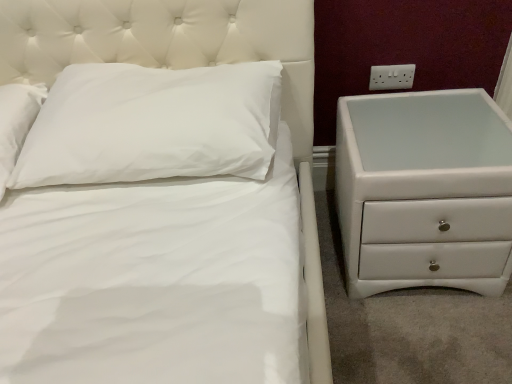
What do you see at coordinates (152, 124) in the screenshot?
I see `white soft pillow at upper left` at bounding box center [152, 124].

In order to face white glossy chest of drawers at right, should I rotate leftwards or rightwards?

To align with it, rotate right about 20.757°.

Locate an element on the screen. The image size is (512, 384). white glossy chest of drawers at right is located at coordinates (424, 191).

This screenshot has height=384, width=512. I want to click on white plastic electrical outlet at upper right, so [392, 77].

Describe the element at coordinates (392, 77) in the screenshot. I see `white plastic electrical outlet at upper right` at that location.

Locate an element on the screen. white soft pillow at upper left is located at coordinates (152, 124).

From the image's perspective, between white soft pillow at upper left and white glossy chest of drawers at right, who is located below?

white glossy chest of drawers at right appears lower in the image.

Does point (120, 73) appear closer or farther from the camera than point (382, 185)?

Point (120, 73).

Is white soft pillow at upper left positioned far away from white glossy chest of drawers at right?

That's not correct — white soft pillow at upper left is a little close to white glossy chest of drawers at right.

Is white plastic electrical outlet at upper right facing towards white soft pillow at upper left?

No, white plastic electrical outlet at upper right is not aimed at white soft pillow at upper left.

Considering the sizes of objects white plastic electrical outlet at upper right and white soft pillow at upper left in the image provided, who is wider, white plastic electrical outlet at upper right or white soft pillow at upper left?

white soft pillow at upper left is wider.

Do you think white plastic electrical outlet at upper right is within white soft pillow at upper left, or outside of it?

white plastic electrical outlet at upper right is not inside white soft pillow at upper left, it's outside.

The height and width of the screenshot is (384, 512). I want to click on electric outlet lying on the right of white soft pillow at upper left, so click(x=392, y=77).

Is white glossy chest of drawers at right at the right side of white soft pillow at upper left?

Indeed, white glossy chest of drawers at right is positioned on the right side of white soft pillow at upper left.

Can you confirm if white glossy chest of drawers at right is thinner than white soft pillow at upper left?

No, white glossy chest of drawers at right is not thinner than white soft pillow at upper left.

From the image's perspective, does white glossy chest of drawers at right appear higher than white soft pillow at upper left?

No.

From a real-world perspective, is white plastic electrical outlet at upper right over white glossy chest of drawers at right?

Correct, in the physical world, white plastic electrical outlet at upper right is higher than white glossy chest of drawers at right.

Between white plastic electrical outlet at upper right and white glossy chest of drawers at right, which one has more height?

white glossy chest of drawers at right is taller.

Considering their positions, is white plastic electrical outlet at upper right located in front of or behind white glossy chest of drawers at right?

Clearly, white plastic electrical outlet at upper right is behind white glossy chest of drawers at right.

Looking at this image, between white plastic electrical outlet at upper right and white glossy chest of drawers at right, which one has larger size?

Bigger between the two is white glossy chest of drawers at right.

Is white glossy chest of drawers at right with white plastic electrical outlet at upper right?

No, white glossy chest of drawers at right is not next to white plastic electrical outlet at upper right.

Find the location of a particular element. chest of drawers located on the right of white plastic electrical outlet at upper right is located at coordinates (424, 191).

Between white glossy chest of drawers at right and white plastic electrical outlet at upper right, which one has more height?

Standing taller between the two is white glossy chest of drawers at right.

Measure the distance between white glossy chest of drawers at right and white plastic electrical outlet at upper right.

white glossy chest of drawers at right and white plastic electrical outlet at upper right are 16.90 inches apart from each other.

From a real-world perspective, which is physically above, white soft pillow at upper left or white plastic electrical outlet at upper right?

white soft pillow at upper left.

Is point (168, 136) behind point (375, 70)?

No.

What are the coordinates of `electric outlet on the right of white soft pillow at upper left` in the screenshot? It's located at (392, 77).

Between white soft pillow at upper left and white plastic electrical outlet at upper right, which one appears on the left side from the viewer's perspective?

white soft pillow at upper left.

Locate an element on the screen. chest of drawers that appears on the right of white soft pillow at upper left is located at coordinates (424, 191).

Locate an element on the screen. The width and height of the screenshot is (512, 384). electric outlet above the white soft pillow at upper left (from the image's perspective) is located at coordinates (392, 77).

Which object lies further to the anchor point white glossy chest of drawers at right, white plastic electrical outlet at upper right or white soft pillow at upper left?

Among the two, white soft pillow at upper left is located further to white glossy chest of drawers at right.

When comparing their distances from white soft pillow at upper left, does white glossy chest of drawers at right or white plastic electrical outlet at upper right seem closer?

white glossy chest of drawers at right.

From the image, which object appears to be nearer to white plastic electrical outlet at upper right, white glossy chest of drawers at right or white soft pillow at upper left?

Among the two, white glossy chest of drawers at right is located nearer to white plastic electrical outlet at upper right.

Estimate the real-world distances between objects in this image. Which object is closer to white glossy chest of drawers at right, white soft pillow at upper left or white plastic electrical outlet at upper right?

white plastic electrical outlet at upper right lies closer to white glossy chest of drawers at right than the other object.

Considering their positions, is white soft pillow at upper left positioned closer to white plastic electrical outlet at upper right than white glossy chest of drawers at right?

Based on the image, white glossy chest of drawers at right appears to be nearer to white plastic electrical outlet at upper right.

Looking at the image, which one is located closer to white soft pillow at upper left, white plastic electrical outlet at upper right or white glossy chest of drawers at right?

Among the two, white glossy chest of drawers at right is located nearer to white soft pillow at upper left.

Identify the location of electric outlet between white soft pillow at upper left and white glossy chest of drawers at right. The width and height of the screenshot is (512, 384). (392, 77).